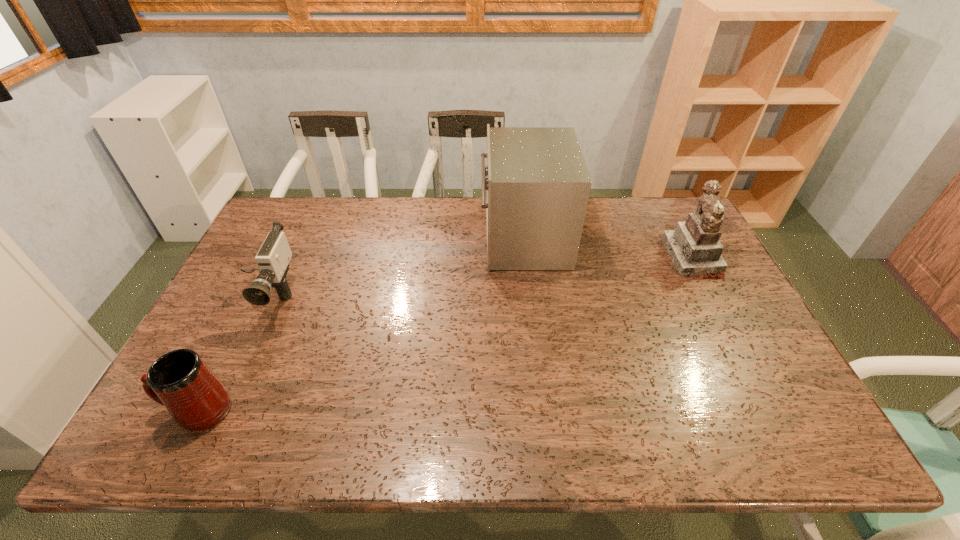
I want to click on object that is at the far right corner, so click(x=694, y=247).

Identify the location of blank area at the far edge. The image size is (960, 540). (613, 239).

You are a GUI agent. You are given a task and a screenshot of the screen. Output one action in this format:
    pyautogui.click(x=<x>, y=<y>)
    Task: Click on the vacant space at the left edge of the desktop
    The image size is (960, 540).
    Given the screenshot: What is the action you would take?
    pyautogui.click(x=237, y=284)

What are the coordinates of `vacant space at the right edge` in the screenshot? It's located at (753, 342).

The height and width of the screenshot is (540, 960). Find the location of `free space at the far right corner of the desktop`. free space at the far right corner of the desktop is located at coordinates (644, 202).

Find the location of `vacant area at the near right corner`. vacant area at the near right corner is located at coordinates (801, 415).

Image resolution: width=960 pixels, height=540 pixels. In order to click on empty location between the camcorder and the figurine in this screenshot , I will do `click(479, 278)`.

The height and width of the screenshot is (540, 960). What are the coordinates of `empty space that is in between the camcorder and the mug` in the screenshot? It's located at (232, 354).

What are the coordinates of `free space between the rightmost object and the camcorder` in the screenshot? It's located at (479, 278).

I want to click on empty space that is in between the figurine and the camcorder, so click(479, 278).